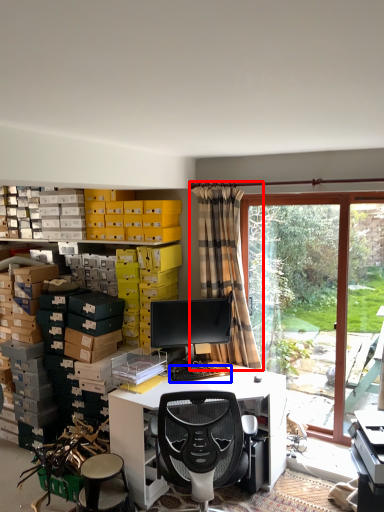
Question: Which object is further to the camera taking this photo, curtain (highlighted by a red box) or computer keyboard (highlighted by a blue box)?

Choices:
 (A) curtain
 (B) computer keyboard

Answer: (A)